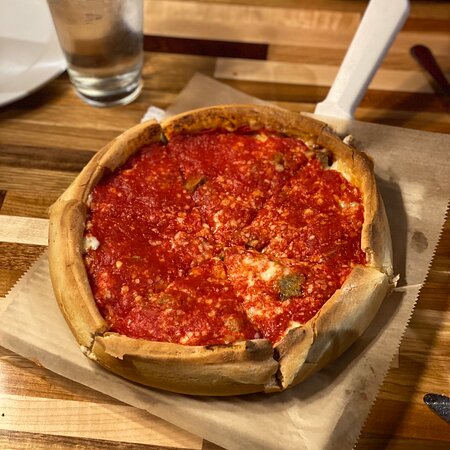
Find the location of `glass`. glass is located at coordinates (120, 72).